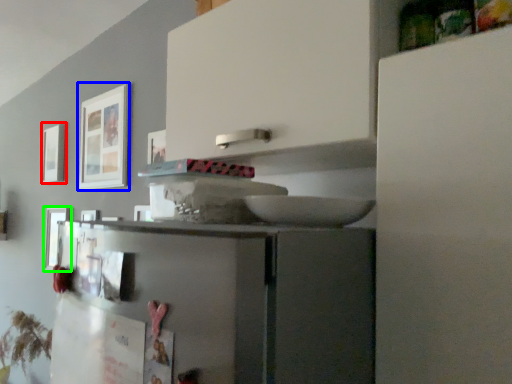
Question: Considering the real-world distances, which object is farthest from picture frame (highlighted by a red box)? picture frame (highlighted by a blue box) or picture frame (highlighted by a green box)?

Choices:
 (A) picture frame
 (B) picture frame

Answer: (A)